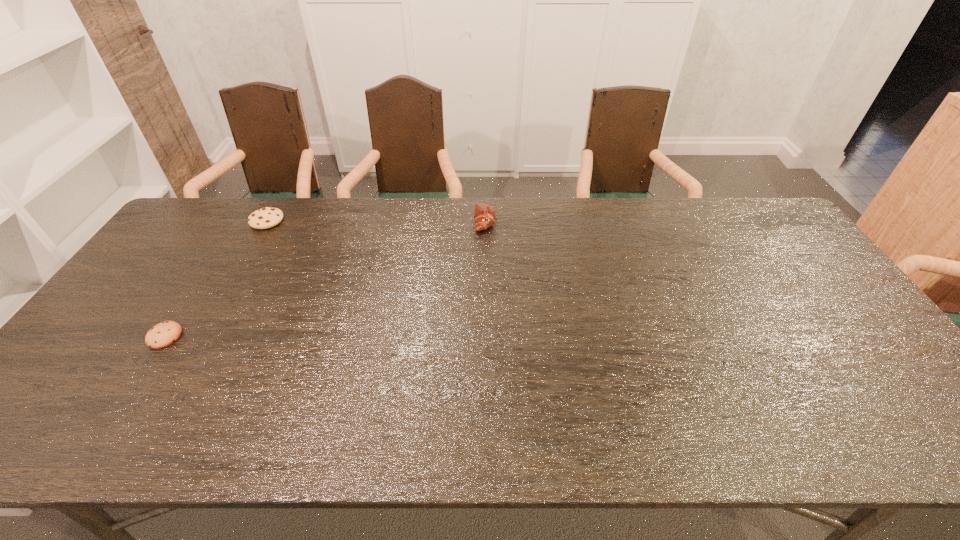
This screenshot has width=960, height=540. Identify the location of cookie that is at the far edge. (267, 217).

Where is `object at the left edge`? The width and height of the screenshot is (960, 540). object at the left edge is located at coordinates (163, 334).

This screenshot has width=960, height=540. Find the location of `free space at the far edge`. free space at the far edge is located at coordinates (680, 231).

This screenshot has height=540, width=960. Find the location of `vacant space at the near edge of the desktop`. vacant space at the near edge of the desktop is located at coordinates (164, 448).

Locate an element on the screen. free space at the left edge is located at coordinates (113, 319).

Image resolution: width=960 pixels, height=540 pixels. In order to click on vacant region at the right edge in this screenshot , I will do `click(844, 377)`.

The height and width of the screenshot is (540, 960). I want to click on vacant space at the far left corner of the desktop, so click(x=244, y=198).

At what (x,y) coordinates should I click in order to perform the action: click on empty space between the tallest object and the nearer cookie. Please return your answer as a coordinate pair (x, y). The image size is (960, 540). Looking at the image, I should click on (324, 279).

You are a GUI agent. You are given a task and a screenshot of the screen. Output one action in this format:
    pyautogui.click(x=<x>, y=<y>)
    Task: Click on the empty space that is in between the tallest object and the nearest object
    This screenshot has height=540, width=960.
    Given the screenshot: What is the action you would take?
    pyautogui.click(x=324, y=279)

The height and width of the screenshot is (540, 960). What are the coordinates of `free area in between the rightmost object and the farther cookie` in the screenshot? It's located at (375, 221).